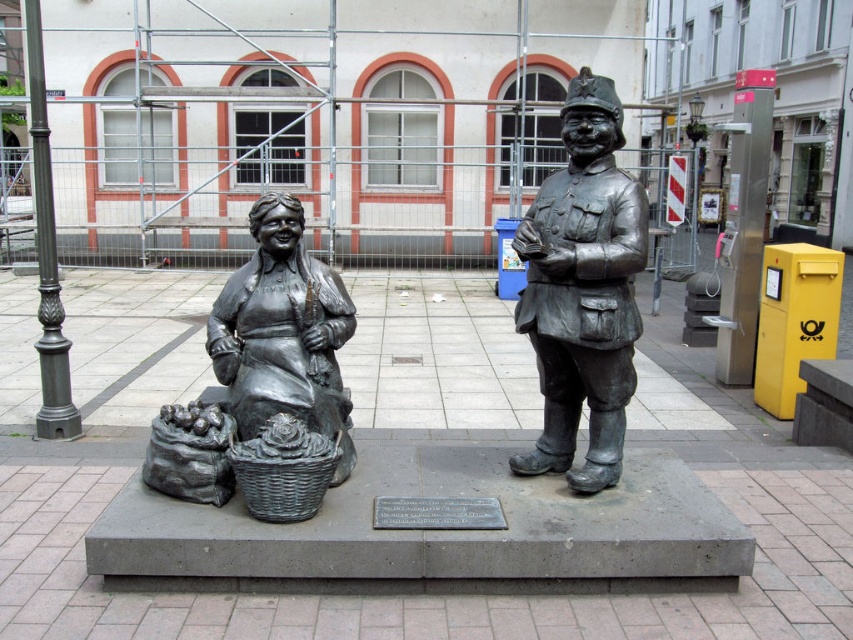
Is point (225, 380) farther from camera compared to point (235, 456)?

Yes, point (225, 380) is behind point (235, 456).

Is bronze statue at left positioned behind rustic wicker basket at lower center?

Yes, bronze statue at left is further from the viewer.

Find the location of `bronze statue at left`. bronze statue at left is located at coordinates (260, 362).

Locate an element on the screen. Image resolution: width=853 pixels, height=640 pixels. bronze statue at left is located at coordinates (260, 362).

Does bronze statue at center appear under rustic wicker basket at lower center?

No.

Measure the distance between point [546,216] and camera.

The distance of point [546,216] from camera is 3.62 meters.

Where is `bronze statue at center`? bronze statue at center is located at coordinates click(583, 289).

Where is `bronze statue at center`? This screenshot has width=853, height=640. bronze statue at center is located at coordinates (583, 289).

Is bronze statue at center shorter than bronze statue at left?

No, bronze statue at center is not shorter than bronze statue at left.

Is point (575, 280) farther from camera compared to point (315, 419)?

That is False.

Locate an element on the screen. The width and height of the screenshot is (853, 640). bronze statue at center is located at coordinates [583, 289].